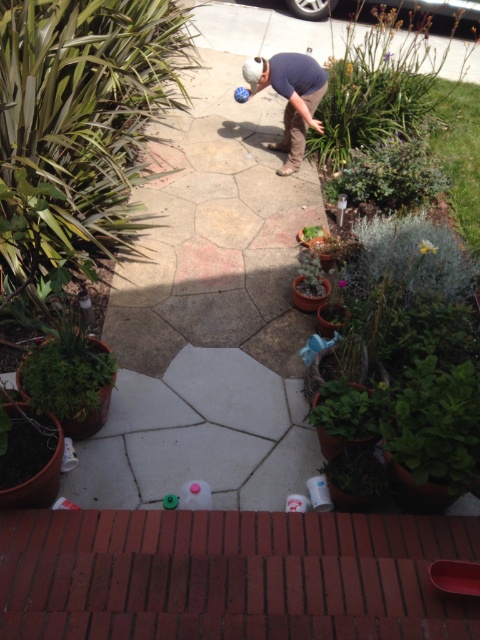
You are a gardener who wants to plant a new shrub that requires more space. Looking at the image, which of the two plants, the green leafy plant at upper right or the purple matte flower at upper center, would you consider removing to make space for the new shrub?

The green leafy plant at upper right is larger in size than the purple matte flower at upper center, so removing the purple matte flower at upper center would free up less space. Therefore, removing the green leafy plant at upper right would provide more space for the new shrub.